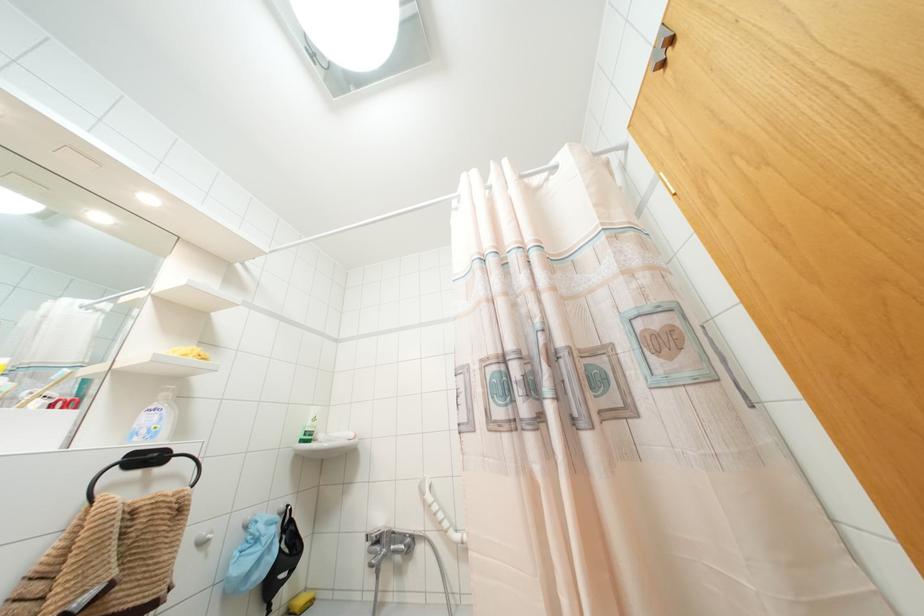
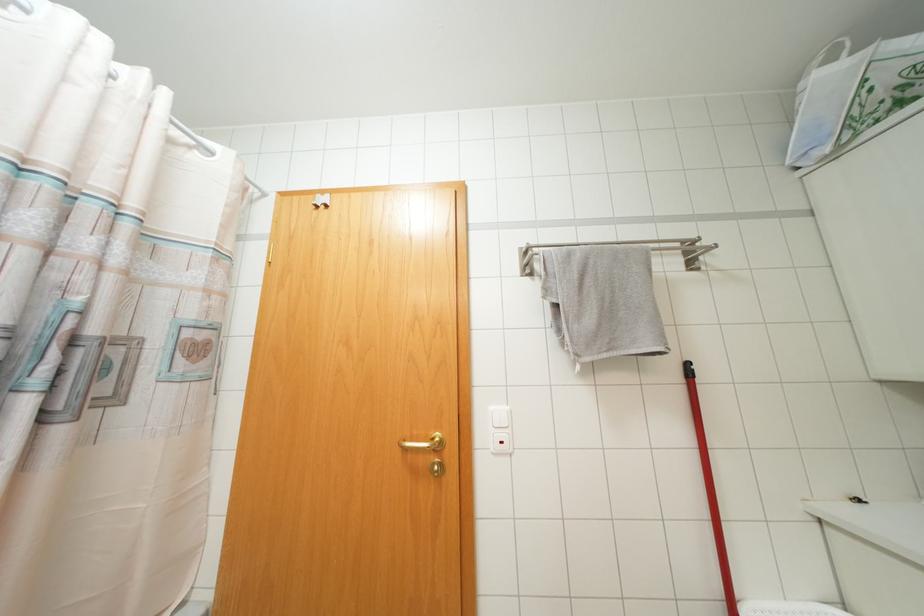
The images are taken continuously from a first-person perspective. In which direction is your viewpoint rotating?

The rotation direction of the camera is right-up.